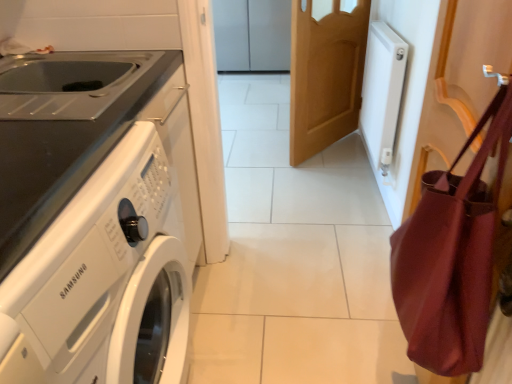
This screenshot has height=384, width=512. What are the coordinates of `vacant area that is in front of light brown wooden door at center` in the screenshot? It's located at (334, 178).